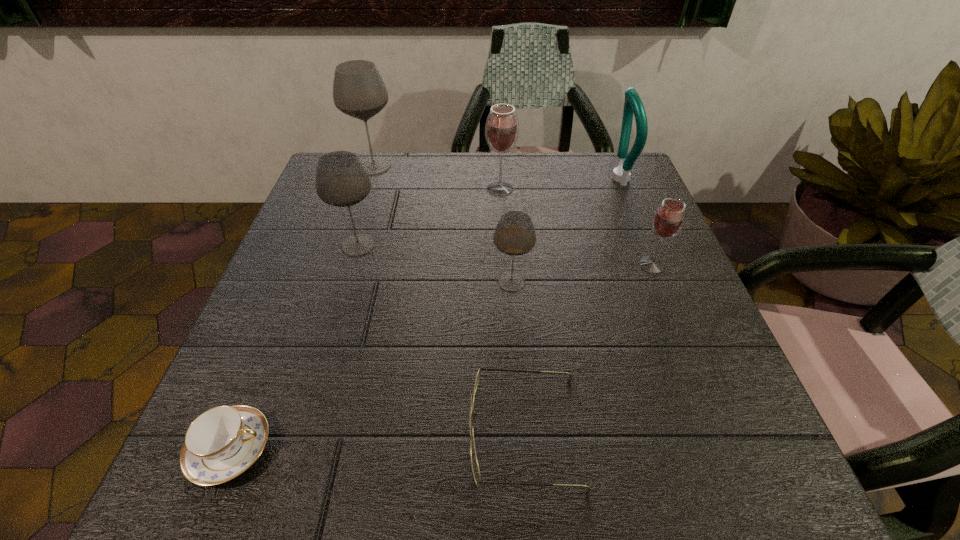
Identify the location of the tallest wineglass. (359, 91).

Where is `the biggest gray wineglass`? the biggest gray wineglass is located at coordinates (359, 91).

Where is `bottle opener`? Image resolution: width=960 pixels, height=540 pixels. bottle opener is located at coordinates (633, 104).

In order to click on the left red wineglass in this screenshot , I will do `click(502, 126)`.

Locate an element on the screen. This screenshot has width=960, height=540. the second farthest wineglass is located at coordinates (502, 126).

The width and height of the screenshot is (960, 540). Identify the location of the second smallest gray wineglass. 341,180.

This screenshot has width=960, height=540. Find the location of `the nearest gray wineglass`. the nearest gray wineglass is located at coordinates (514, 235).

Identify the location of the smallest gray wineglass. This screenshot has height=540, width=960. (514, 235).

Find the location of a particular element. Image resolution: width=960 pixels, height=540 pixels. the rightmost wineglass is located at coordinates (668, 220).

The height and width of the screenshot is (540, 960). I want to click on the right red wineglass, so click(x=668, y=220).